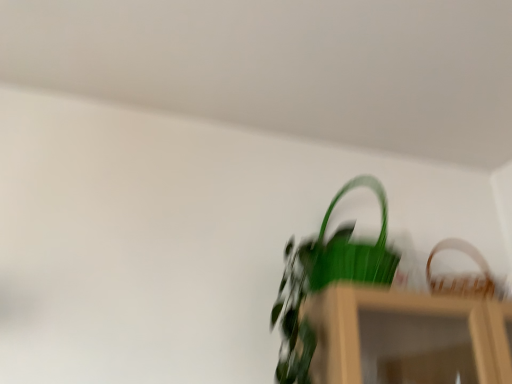
Question: Is green matte plant at center spatially inside wooden woven basket at upper right, or outside of it?

Choices:
 (A) outside
 (B) inside

Answer: (A)

Question: Is green matte plant at center in front of or behind wooden woven basket at upper right in the image?

Choices:
 (A) behind
 (B) front

Answer: (B)

Question: From a real-world perspective, is green matte plant at center physically located above or below wooden woven basket at upper right?

Choices:
 (A) below
 (B) above

Answer: (A)

Question: Does point click(481, 284) appear closer or farther from the camera than point click(307, 344)?

Choices:
 (A) farther
 (B) closer

Answer: (A)

Question: Would you say wooden woven basket at upper right is inside or outside green matte plant at center?

Choices:
 (A) inside
 (B) outside

Answer: (B)

Question: Relative to green matte plant at center, is wooden woven basket at upper right in front or behind?

Choices:
 (A) front
 (B) behind

Answer: (B)

Question: Is wooden woven basket at upper right wider or thinner than green matte plant at center?

Choices:
 (A) wide
 (B) thin

Answer: (B)